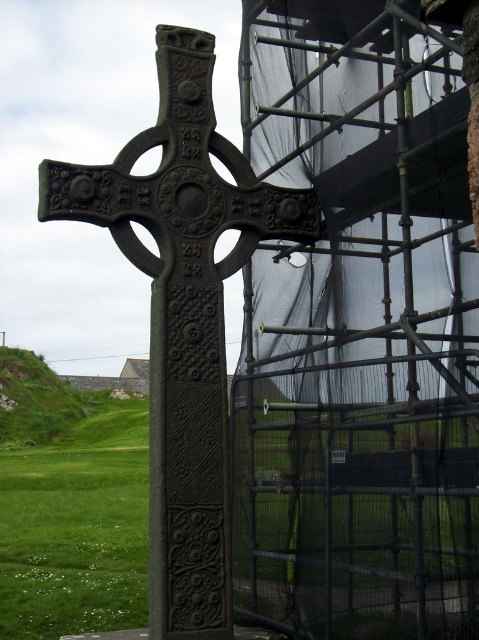
Does metal scaffolding at right have a lesser width compared to dark gray cast iron cross at center?

Indeed, metal scaffolding at right has a lesser width compared to dark gray cast iron cross at center.

Does metal scaffolding at right appear on the left side of dark gray cast iron cross at center?

In fact, metal scaffolding at right is to the right of dark gray cast iron cross at center.

Describe the element at coordinates (358, 330) in the screenshot. Image resolution: width=479 pixels, height=640 pixels. I see `metal scaffolding at right` at that location.

Find the location of a particular element. The image size is (479, 640). metal scaffolding at right is located at coordinates (358, 330).